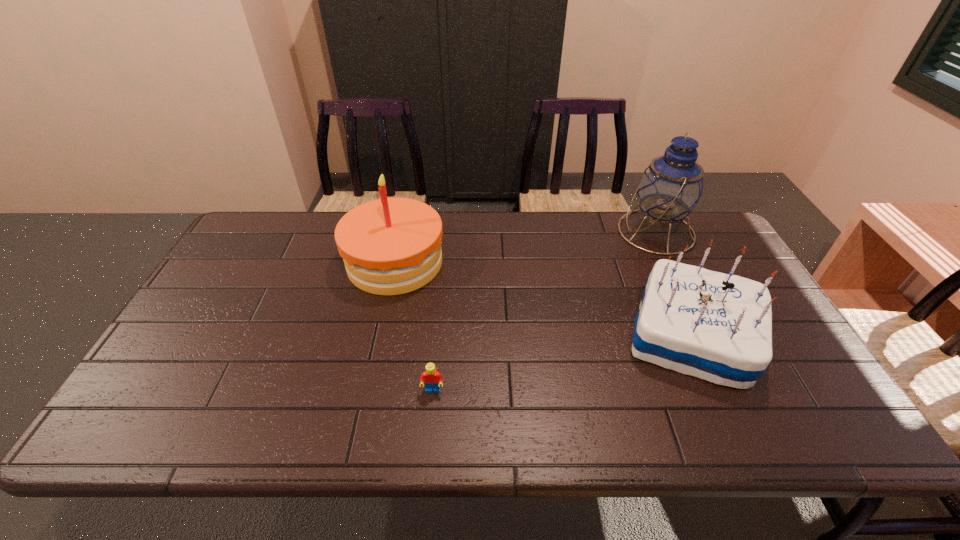
The height and width of the screenshot is (540, 960). What are the coordinates of `vacant space located 0.090m on the face of the shortest object` in the screenshot? It's located at (429, 433).

Identify the location of lantern present at the far edge. This screenshot has width=960, height=540. (670, 188).

Locate an element on the screen. The width and height of the screenshot is (960, 540). birthday cake at the far edge is located at coordinates (390, 246).

Locate an element on the screen. The height and width of the screenshot is (540, 960). lantern that is at the right edge is located at coordinates (670, 188).

You are a GUI agent. You are given a task and a screenshot of the screen. Output one action in this format:
    pyautogui.click(x=<x>, y=<y>)
    Task: Click on the birthday cake that is positioned at the right edge
    The height and width of the screenshot is (540, 960).
    Given the screenshot: What is the action you would take?
    pyautogui.click(x=714, y=326)

Identify the location of object at the far right corner. (670, 188).

Image resolution: width=960 pixels, height=540 pixels. In the image, there is a desktop. Identify the location of vacant space at the far edge. (492, 232).

The image size is (960, 540). Find the location of `free space at the near edge`. free space at the near edge is located at coordinates (689, 437).

Where is `free region at the left edge of the desktop`? free region at the left edge of the desktop is located at coordinates (200, 295).

The height and width of the screenshot is (540, 960). Identify the location of free space at the right edge. pos(739,272).